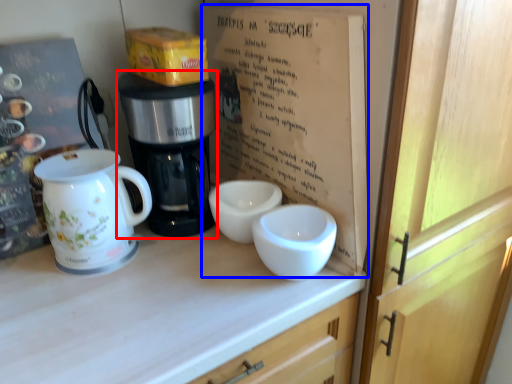
Question: Which of the following is the closest to the observer, coffee maker (highlighted by a red box) or book (highlighted by a blue box)?

Choices:
 (A) coffee maker
 (B) book

Answer: (B)